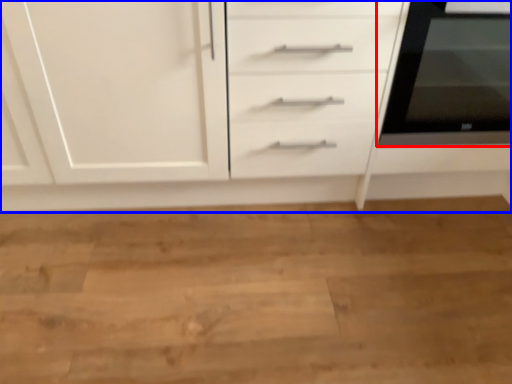
Question: Which of the following is the farthest to the observer, home appliance (highlighted by a red box) or chest of drawers (highlighted by a blue box)?

Choices:
 (A) home appliance
 (B) chest of drawers

Answer: (A)